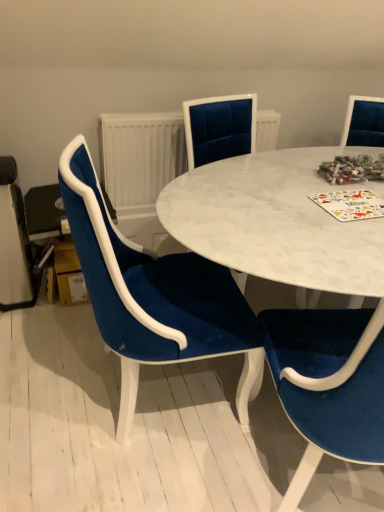
Locate an element on the screen. The width and height of the screenshot is (384, 512). free space to the left of multicolored paper at center is located at coordinates (291, 214).